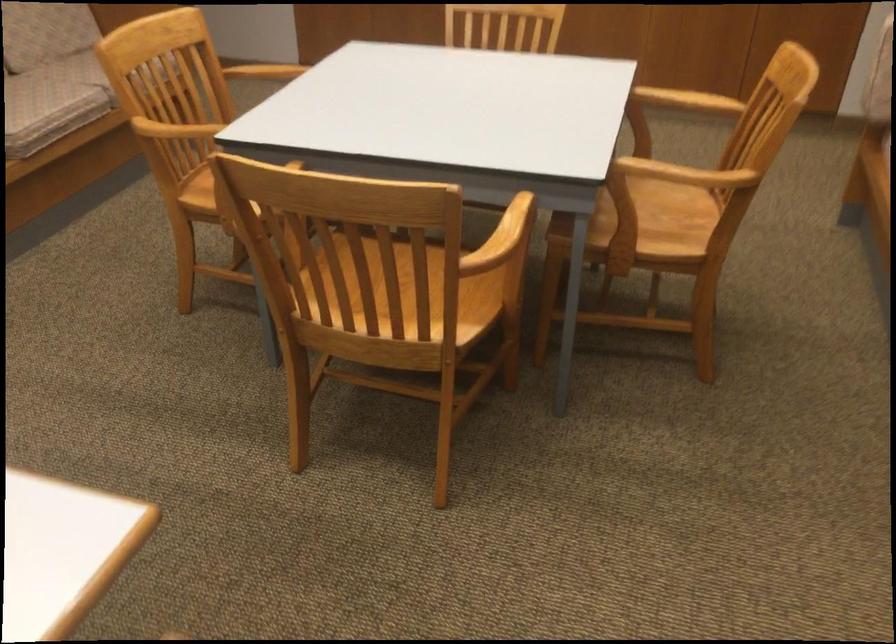
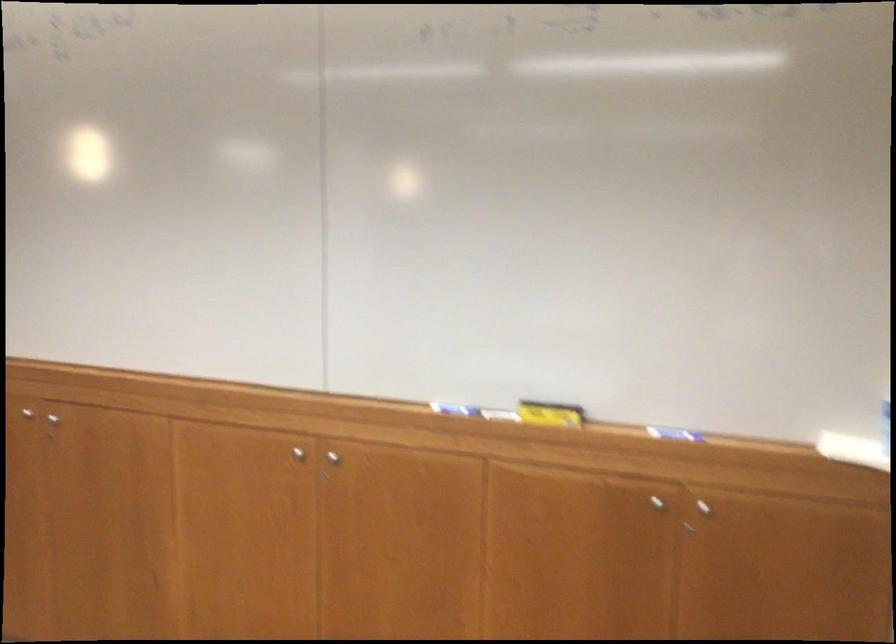
Looking at this image, in a continuous first-person perspective shot, in which direction is the camera moving?

The cameraman moved toward right, forward.